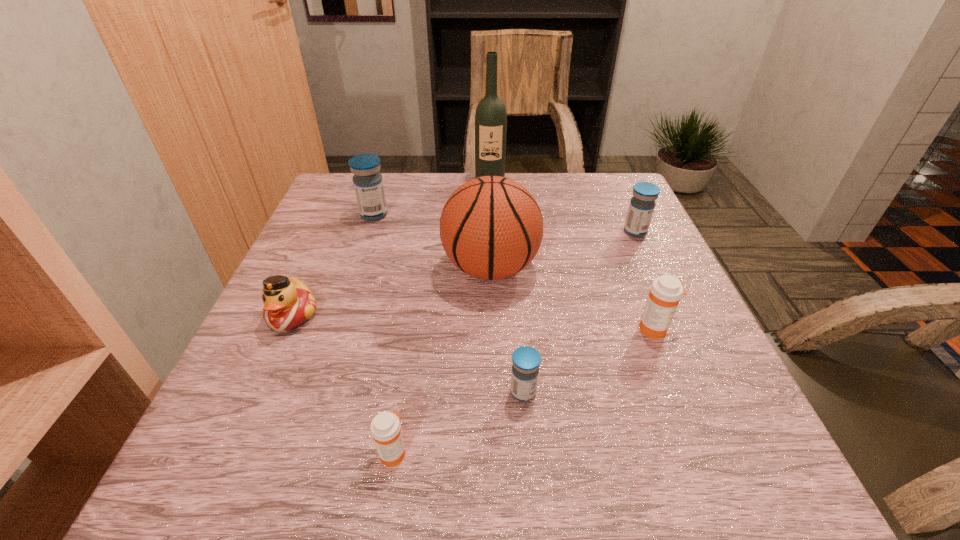
Image resolution: width=960 pixels, height=540 pixels. Identify the location of duck that is at the left edge. (288, 303).

At what (x,y) coordinates should I click in order to perform the action: click on object at the far left corner. Please return your answer as a coordinate pair (x, y). Looking at the image, I should click on (368, 184).

Where is `vacant space at the far edge of the desktop`? The height and width of the screenshot is (540, 960). vacant space at the far edge of the desktop is located at coordinates (552, 178).

You are a GUI agent. You are given a task and a screenshot of the screen. Output one action in this format:
    pyautogui.click(x=<x>, y=<y>)
    Task: Click on the blank space at the near edge of the desktop
    
    Given the screenshot: What is the action you would take?
    pyautogui.click(x=584, y=443)

The width and height of the screenshot is (960, 540). In order to click on free space at the left edge of the desktop in this screenshot , I will do `click(221, 407)`.

The image size is (960, 540). What are the coordinates of `vacant region at the right edge of the desktop` in the screenshot? It's located at (639, 350).

The width and height of the screenshot is (960, 540). In the image, there is a desktop. Identify the location of vacant area at the near left corner. (265, 463).

You are a GUI agent. You are given a task and a screenshot of the screen. Output one action in this format:
    pyautogui.click(x=<x>, y=<y>)
    Task: Click on the vacant region at the far right corner of the desktop
    This screenshot has width=960, height=540.
    Given the screenshot: What is the action you would take?
    pyautogui.click(x=625, y=193)

I want to click on vacant space at the near right corner of the desktop, so click(x=780, y=495).

I want to click on vacant space that's between the second smallest blue medicine and the third nearest medicine, so click(645, 280).